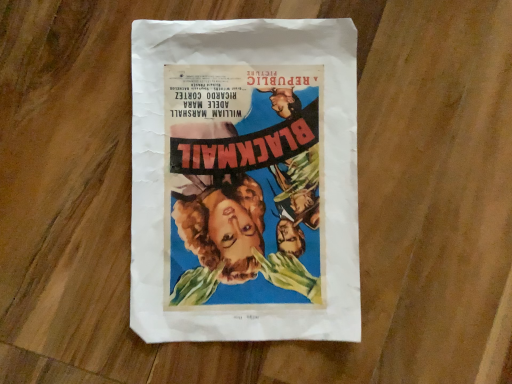
At what (x,y) coordinates should I click in order to perform the action: click on free spot above vintage paper poster at center (from a real-world perspective). Please return your answer as a coordinate pair (x, y). This screenshot has height=384, width=512. Looking at the image, I should click on (249, 179).